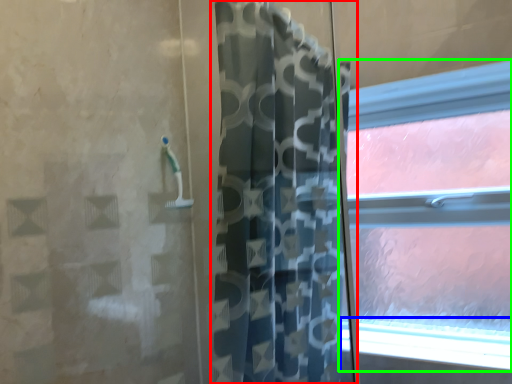
Question: Estimate the real-world distances between objects in this image. Which object is farther from curtain (highlighted by a red box), window sill (highlighted by a blue box) or window (highlighted by a green box)?

Choices:
 (A) window sill
 (B) window

Answer: (B)